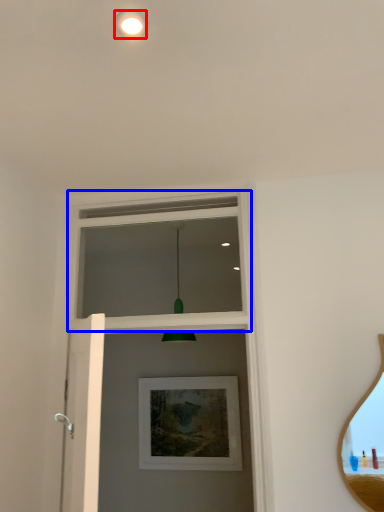
Question: Among these objects, which one is nearest to the camera, droplight (highlighted by a red box) or window frame (highlighted by a blue box)?

Choices:
 (A) droplight
 (B) window frame

Answer: (A)